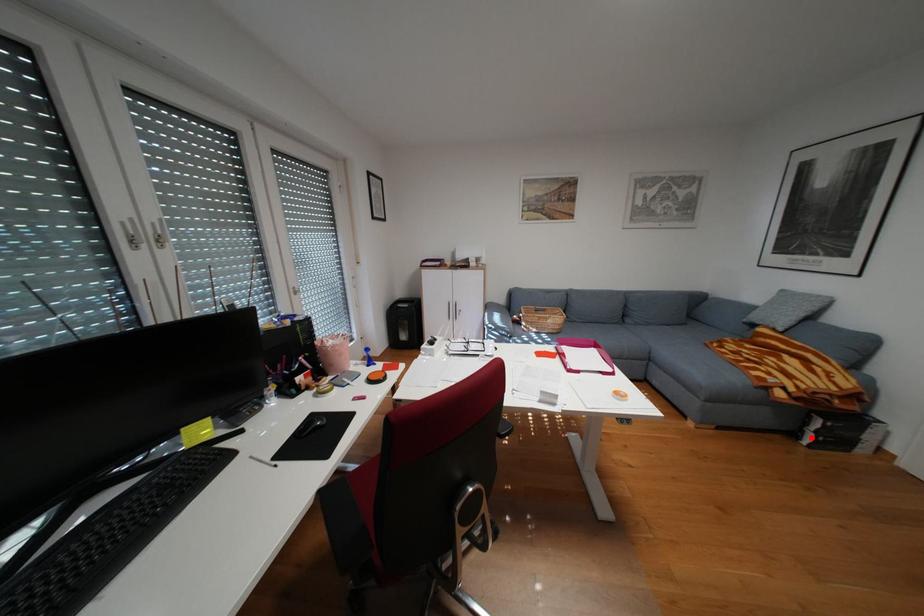
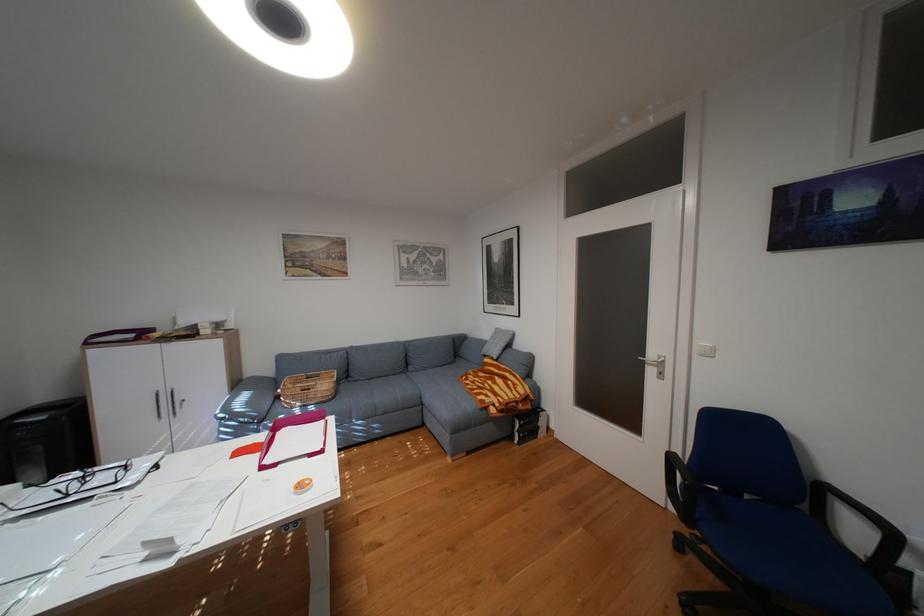
In the second image, find the point that corresponds to the highlighted location in the first image.

(526, 438)